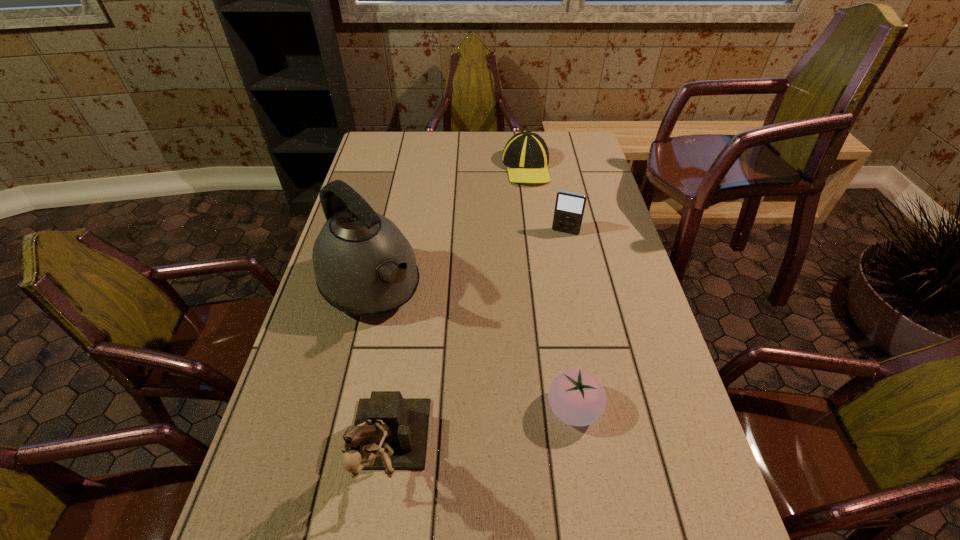
Image resolution: width=960 pixels, height=540 pixels. Find the location of `vacant space on the desktop that is between the figurine and the tomato and is positioned on the front-facing side of the third shortest object`. vacant space on the desktop that is between the figurine and the tomato and is positioned on the front-facing side of the third shortest object is located at coordinates (504, 426).

Identify the location of vacant space on the desktop that is between the figurine and the tomato and is positioned with the brim of the baseball cap facing forward. (484, 431).

Image resolution: width=960 pixels, height=540 pixels. I want to click on free space on the desktop that is between the figurine and the tomato and is positioned at the spout of the kettle, so click(506, 426).